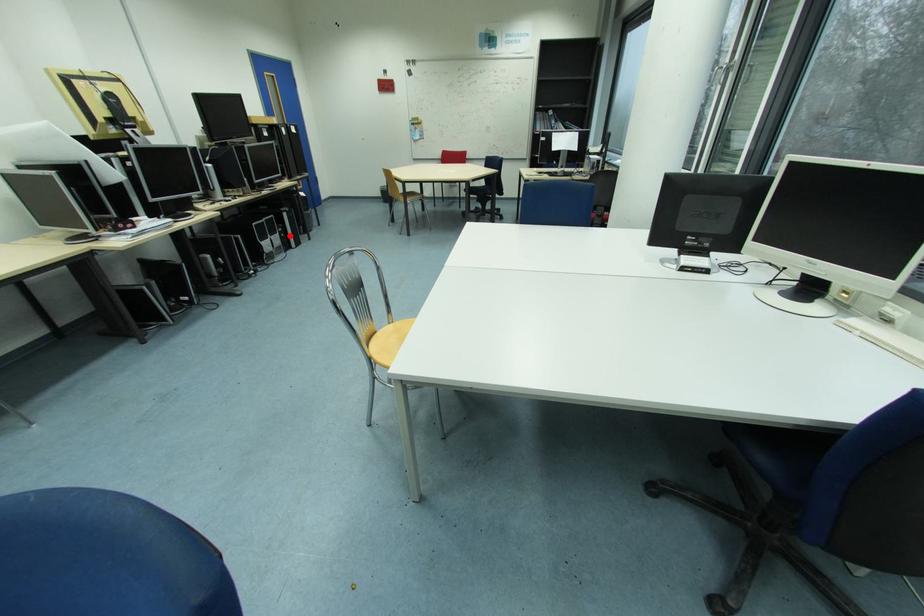
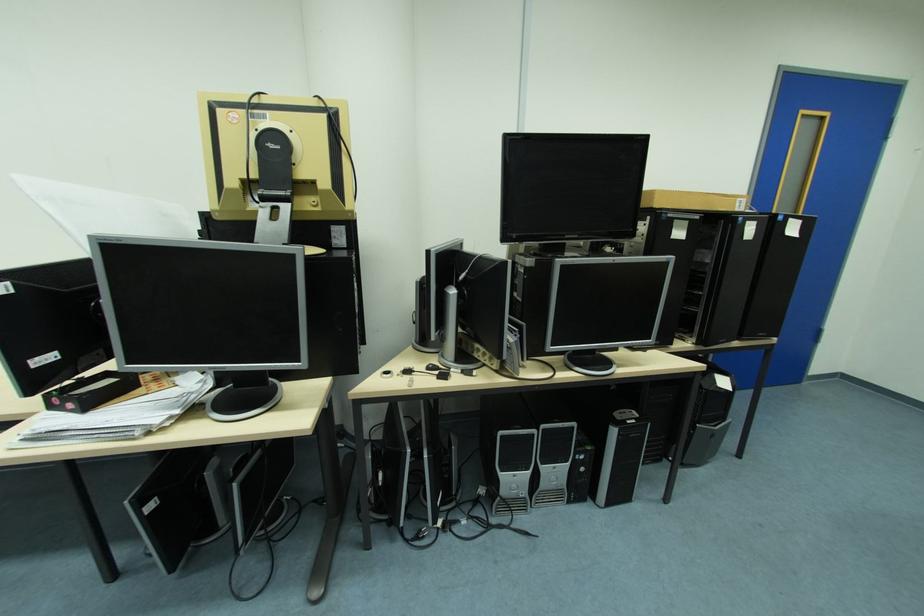
Question: I am providing you with two images of the same scene from different viewpoints. Given a red point in image1, look at the same physical point in image2. Is it:

Choices:
 (A) Closer to the viewpoint
 (B) Farther from the viewpoint

Answer: (B)